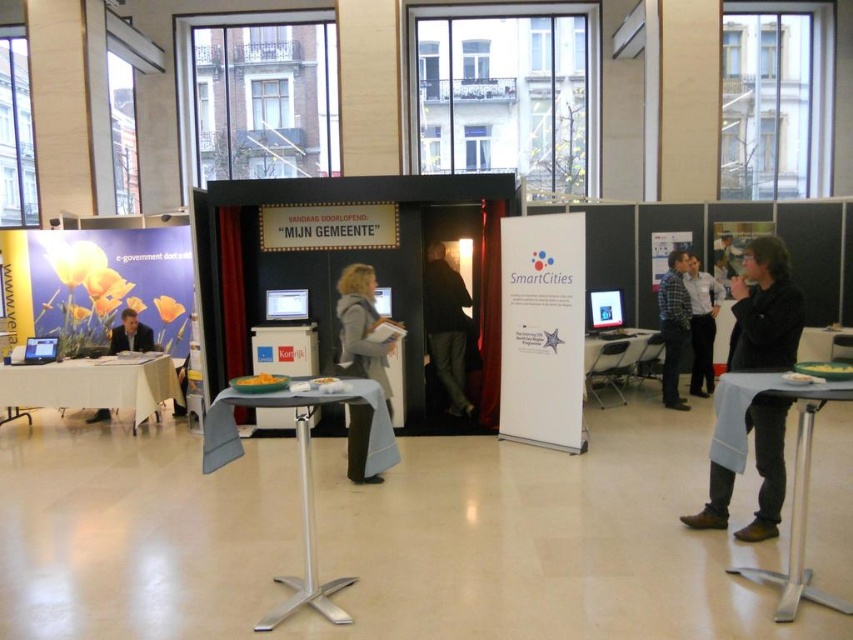
Question: Is light gray fabric coat at center smaller than dark gray jacket at center?

Choices:
 (A) no
 (B) yes

Answer: (B)

Question: Can you confirm if gray fabric table at center is thinner than matte black monitor at center?

Choices:
 (A) yes
 (B) no

Answer: (B)

Question: Which point is closer to the camera taking this photo?

Choices:
 (A) (363, 339)
 (B) (55, 397)

Answer: (A)

Question: Which point is closer to the camera?

Choices:
 (A) matte black jacket at left
 (B) metallic silver table at lower right
 (C) gray fabric table at center
 (D) dark gray jacket at center

Answer: (B)

Question: Which point is closer to the camera?

Choices:
 (A) (305, 321)
 (B) (33, 342)

Answer: (A)

Question: Is gray fabric table at center positioned before metallic silver table at center?

Choices:
 (A) yes
 (B) no

Answer: (A)